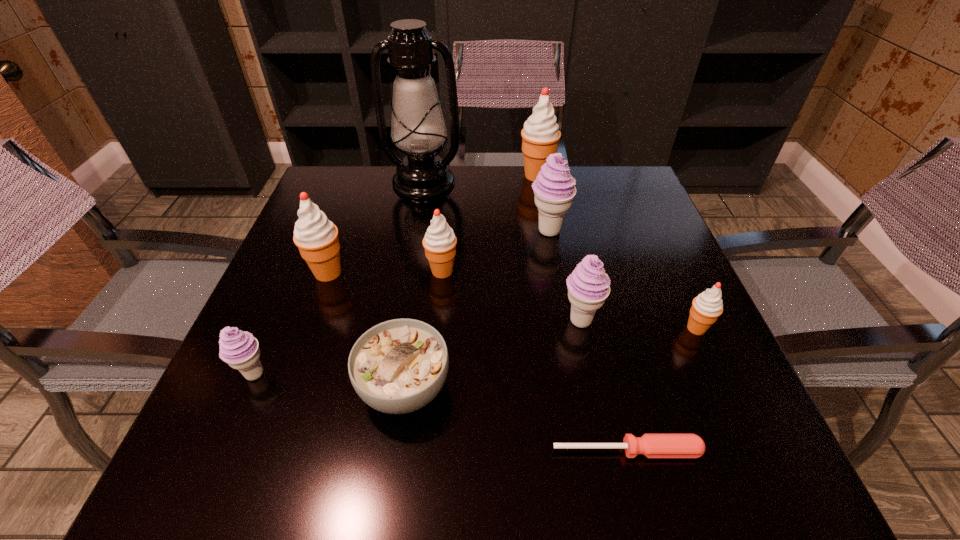
The height and width of the screenshot is (540, 960). In order to click on free spot between the soup bowl and the nearest object in this screenshot , I will do `click(516, 418)`.

What are the coordinates of `free point between the rightmost object and the leftmost purple icecream` in the screenshot? It's located at (475, 351).

This screenshot has width=960, height=540. I want to click on unoccupied position between the screwdriver and the black oil lamp, so click(x=525, y=316).

Find the location of a particular element. This screenshot has height=540, width=960. empty space that is in between the white soup bowl and the red screwdriver is located at coordinates (516, 418).

Where is `free space between the leftmost red icecream and the second red icecream from left to right`? free space between the leftmost red icecream and the second red icecream from left to right is located at coordinates (385, 272).

Identify the location of vacant region between the second tallest object and the soup bowl. This screenshot has width=960, height=540. (470, 281).

Where is `vacant area that lies between the tallest object and the rightmost object`? This screenshot has width=960, height=540. vacant area that lies between the tallest object and the rightmost object is located at coordinates (560, 255).

Where is `free spot between the tallest object and the nearest icecream`? Image resolution: width=960 pixels, height=540 pixels. free spot between the tallest object and the nearest icecream is located at coordinates (339, 278).

Identify the location of object that stands as the ninth closest to the tallest object. (650, 445).

Select which object appears as the third closest to the third smallest red icecream. Please provide its 2D coordinates. Your answer should be formatted as a tuple, i.e. [(x, y)], where the tuple contains the x and y coordinates of a point satisfying the conditions above.

[(240, 350)]